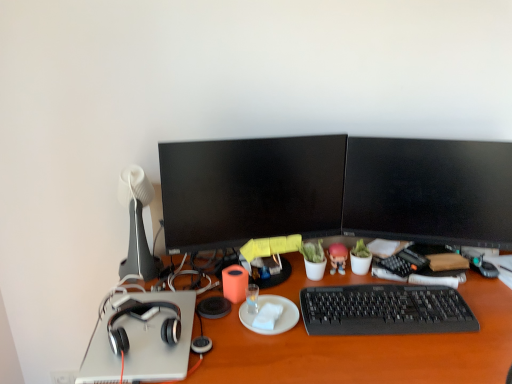
The height and width of the screenshot is (384, 512). What are the coordinates of `spots to the right of orange matte cup at center` in the screenshot? It's located at pyautogui.click(x=282, y=288).